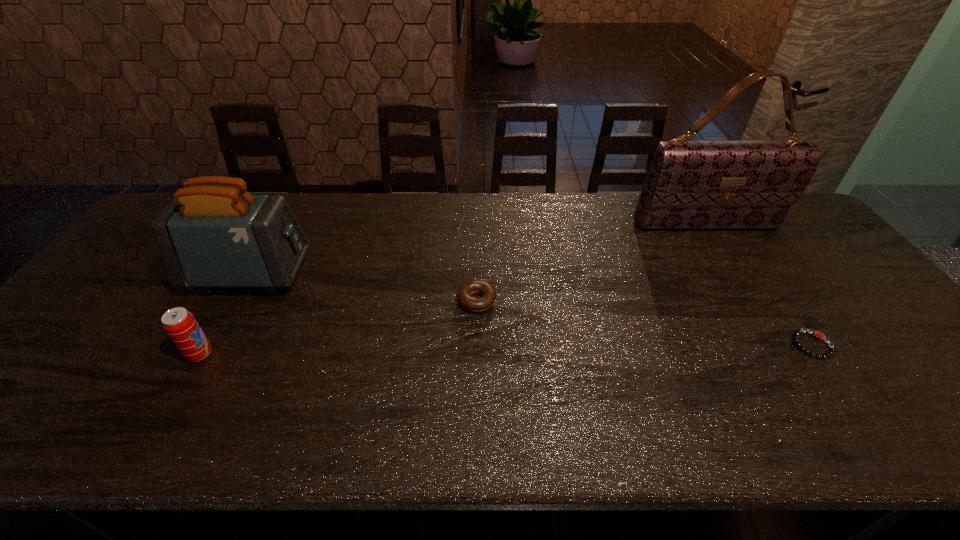
Where is `the third closest object to the fourth shortest object`? Image resolution: width=960 pixels, height=540 pixels. the third closest object to the fourth shortest object is located at coordinates (690, 184).

Point out which object is positioned as the fourth nearest to the handbag. Please provide its 2D coordinates. Your answer should be formatted as a tuple, i.e. [(x, y)], where the tuple contains the x and y coordinates of a point satisfying the conditions above.

[(180, 325)]

Find the location of `free point that satisfies the following two spatial constraints: 1. on the front-facing side of the toaster; 2. on the back side of the bracelet`. free point that satisfies the following two spatial constraints: 1. on the front-facing side of the toaster; 2. on the back side of the bracelet is located at coordinates (212, 345).

Locate an element on the screen. Image resolution: width=960 pixels, height=540 pixels. vacant point that satisfies the following two spatial constraints: 1. on the front-facing side of the toaster; 2. on the back side of the fourth tallest object is located at coordinates (237, 301).

At what (x,y) coordinates should I click in order to perform the action: click on vacant region that satisfies the following two spatial constraints: 1. on the front-facing side of the third object from left to right; 2. on the right side of the second tallest object. Please return your answer as a coordinate pair (x, y). The height and width of the screenshot is (540, 960). Looking at the image, I should click on (237, 301).

Find the location of `vacant region that satisfies the following two spatial constraints: 1. on the back side of the soda can; 2. on the right side of the doughnut`. vacant region that satisfies the following two spatial constraints: 1. on the back side of the soda can; 2. on the right side of the doughnut is located at coordinates (230, 301).